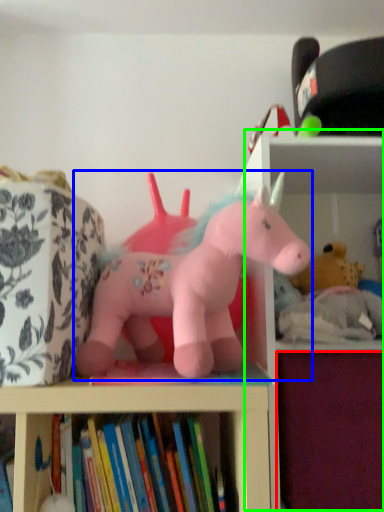
Question: Which is farther away from drawer (highlighted by a red box)? toy (highlighted by a blue box) or bookshelf (highlighted by a green box)?

Choices:
 (A) toy
 (B) bookshelf

Answer: (B)